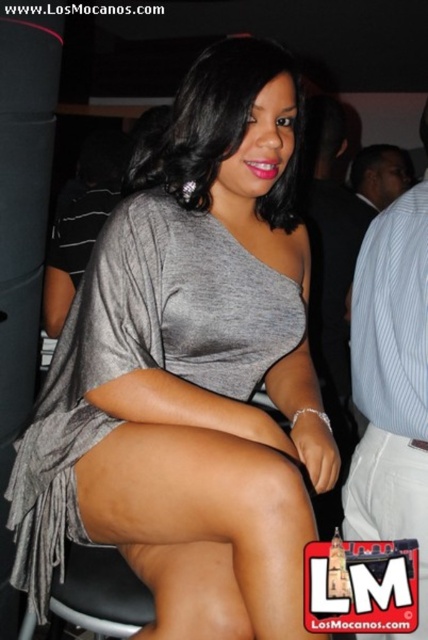
Question: In this image, where is gray matte dress at center located relative to white cotton shorts at lower right?

Choices:
 (A) below
 (B) above

Answer: (B)

Question: Which point is farther from the camera taking this photo?

Choices:
 (A) (225, 180)
 (B) (362, 356)
 (C) (407, 456)

Answer: (B)

Question: Does gray matte dress at center appear on the right side of light blue striped shirt at right?

Choices:
 (A) yes
 (B) no

Answer: (B)

Question: Among these points, which one is farthest from the camera?

Choices:
 (A) (427, 605)
 (B) (421, 451)
 (C) (238, 369)

Answer: (A)

Question: Is light blue striped shirt at right closer to camera compared to white cotton shorts at lower right?

Choices:
 (A) yes
 (B) no

Answer: (B)

Question: Estimate the real-world distances between objects in this image. Which object is closer to the light blue striped shirt at right?

Choices:
 (A) white cotton shorts at lower right
 (B) gray matte dress at center

Answer: (A)